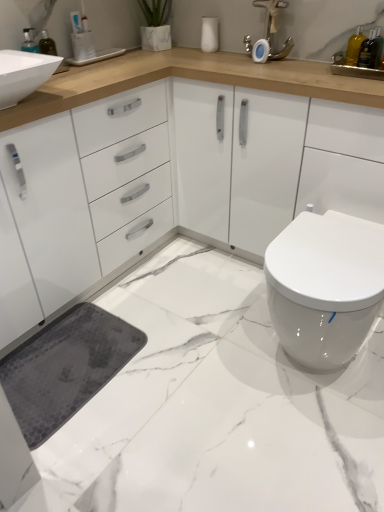
This screenshot has width=384, height=512. I want to click on vacant space situated above white marble floor at lower right (from a real-world perspective), so (150, 367).